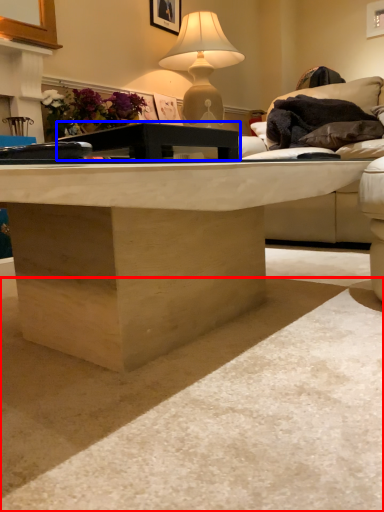
Question: Which object is closer to the camera taking this photo, concrete (highlighted by a red box) or table (highlighted by a blue box)?

Choices:
 (A) concrete
 (B) table

Answer: (A)